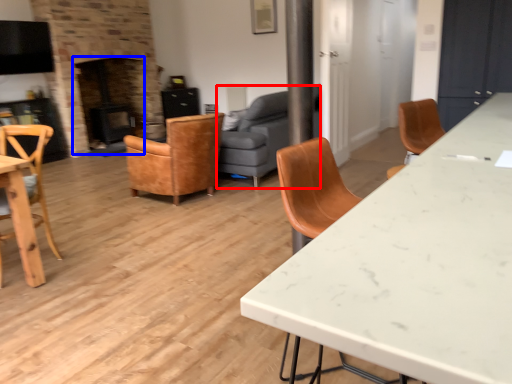
Question: Which of the following is the farthest to the observer, studio couch (highlighted by a red box) or fireplace (highlighted by a blue box)?

Choices:
 (A) studio couch
 (B) fireplace

Answer: (B)